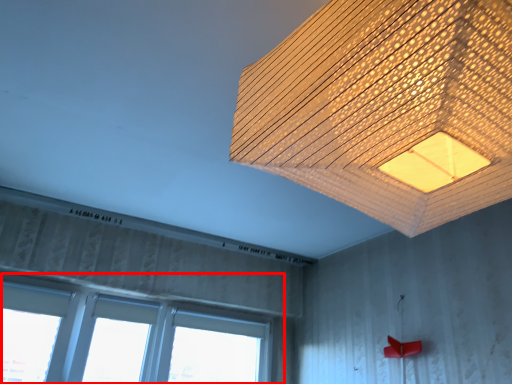
Question: From the image's perspective, what is the correct spatial relationship of window (annotated by the red box) in relation to lamp?

Choices:
 (A) below
 (B) above

Answer: (A)